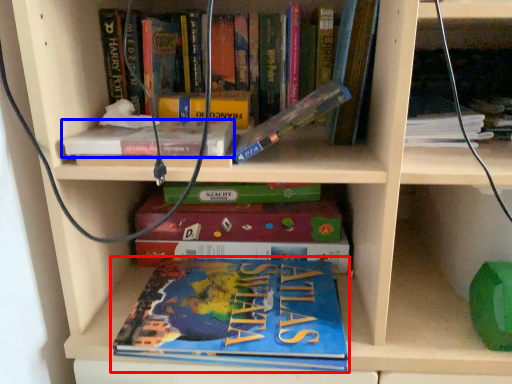
Question: Which point is further to the camera, book (highlighted by a red box) or book (highlighted by a blue box)?

Choices:
 (A) book
 (B) book

Answer: (A)